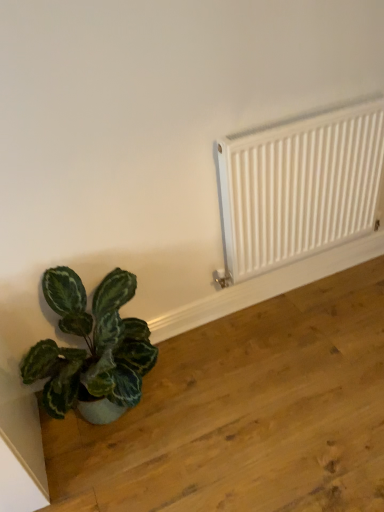
Image resolution: width=384 pixels, height=512 pixels. Describe the element at coordinates (300, 185) in the screenshot. I see `white matte radiator at upper right` at that location.

Find the location of a particular element. The width and height of the screenshot is (384, 512). white matte radiator at upper right is located at coordinates (300, 185).

Find the location of a particular element. white matte radiator at upper right is located at coordinates (300, 185).